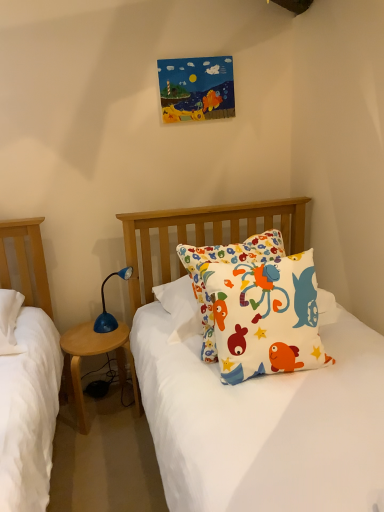
You are a GUI agent. You are given a task and a screenshot of the screen. Output one action in this format:
    pyautogui.click(x=<x>, y=<y>)
    Task: Click on the vacant space situated above wooden nightstand at left (from a real-world perspective)
    The width and height of the screenshot is (384, 512).
    Given the screenshot: What is the action you would take?
    pyautogui.click(x=98, y=334)